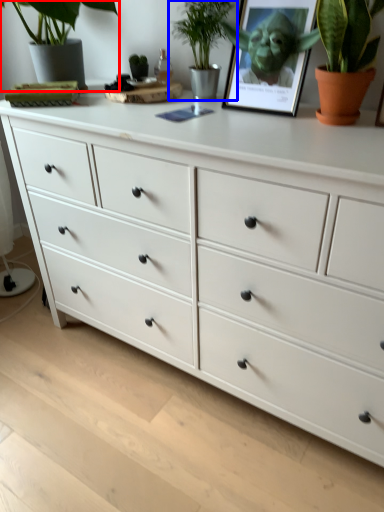
Question: Among these objects, which one is nearest to the camera, houseplant (highlighted by a red box) or houseplant (highlighted by a blue box)?

Choices:
 (A) houseplant
 (B) houseplant

Answer: (A)